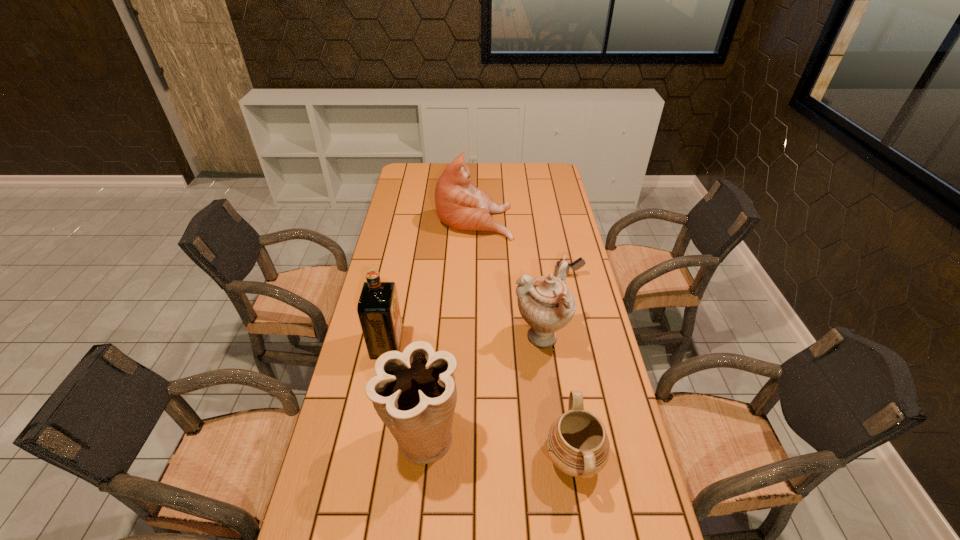
Find the location of a particular element. This screenshot has width=960, height=540. object that is the closest to the shortest urn is located at coordinates (546, 304).

What are the coordinates of `the second closest urn to the farthest urn` in the screenshot? It's located at (414, 393).

At what (x,y) coordinates should I click in order to perform the action: click on urn identified as the third closest to the liquor. Please return your answer as a coordinate pair (x, y). Looking at the image, I should click on (576, 442).

At what (x,y) coordinates should I click in order to perform the action: click on vacant point that satisfies the following two spatial constraints: 1. on the front side of the farthest urn; 2. on the front label of the liquor. Please return your answer as a coordinate pair (x, y). This screenshot has width=960, height=540. Looking at the image, I should click on (541, 345).

Identify the location of vacant space that satisfies the following two spatial constraints: 1. on the back side of the farthest urn; 2. on the face of the farthest object. (525, 219).

You are a GUI agent. You are given a task and a screenshot of the screen. Output one action in this format:
    pyautogui.click(x=<x>, y=<y>)
    Task: Click on the free point that satisfies the following two spatial constraints: 1. on the face of the igniter; 2. on the right side of the farthest object
    The height and width of the screenshot is (540, 960).
    Given the screenshot: What is the action you would take?
    pyautogui.click(x=473, y=275)

I want to click on vacant space that satisfies the following two spatial constraints: 1. on the face of the farthest object; 2. on the left side of the shortest object, so click(x=473, y=275).

In order to click on vacant space that satisfies the following two spatial constraints: 1. on the back side of the farthest urn; 2. on the face of the farthest object in this screenshot , I will do `click(525, 219)`.